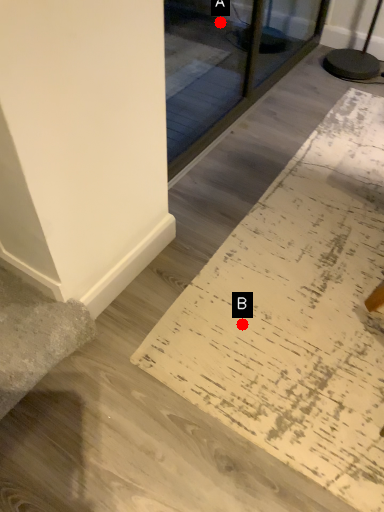
Question: Two points are circled on the image, labeled by A and B beside each circle. Which point is closer to the camera taking this photo?

Choices:
 (A) A is closer
 (B) B is closer

Answer: (B)